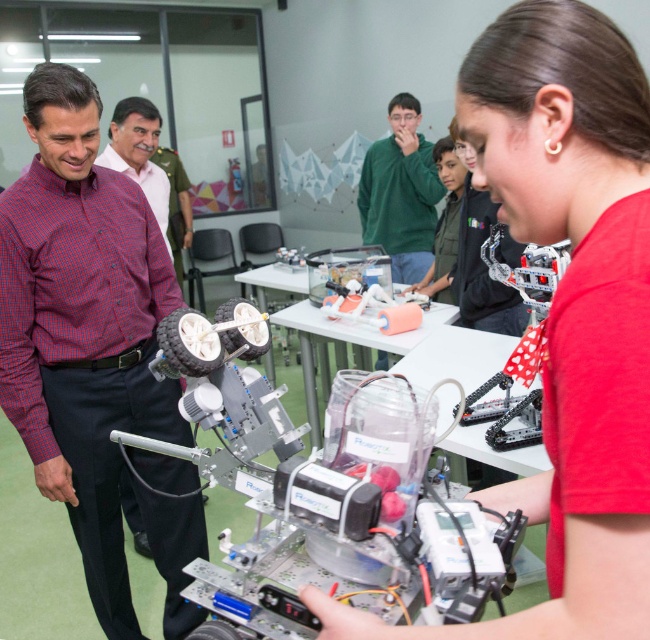
Is red checkered shirt at center shorter than red checkered shirt at left?

Incorrect, red checkered shirt at center's height does not fall short of red checkered shirt at left's.

Is red checkered shirt at center further to the viewer compared to red checkered shirt at left?

No, red checkered shirt at center is in front of red checkered shirt at left.

Find the location of a particular element. red checkered shirt at center is located at coordinates (83, 324).

The image size is (650, 640). What are the coordinates of `red checkered shirt at center` in the screenshot? It's located at (83, 324).

Can you confirm if red checkered shirt at left is positioned below green matte sweater at center?

Yes, red checkered shirt at left is below green matte sweater at center.

Between red checkered shirt at left and green matte sweater at center, which one has less height?

With less height is red checkered shirt at left.

Is point (70, 332) positioned behind point (411, 140)?

That is False.

You are a GUI agent. You are given a task and a screenshot of the screen. Output one action in this format:
    pyautogui.click(x=<x>, y=<y>)
    Task: Click on the red checkered shirt at left
    
    Given the screenshot: What is the action you would take?
    pyautogui.click(x=73, y=284)

Does red checkered shirt at center have a larger size compared to green matte sweater at center?

Actually, red checkered shirt at center might be smaller than green matte sweater at center.

Is red checkered shirt at center in front of green matte sweater at center?

Yes, red checkered shirt at center is in front of green matte sweater at center.

Is point (150, 260) farther from viewer compared to point (365, 177)?

That is False.

Where is `red checkered shirt at center`? Image resolution: width=650 pixels, height=640 pixels. red checkered shirt at center is located at coordinates (83, 324).